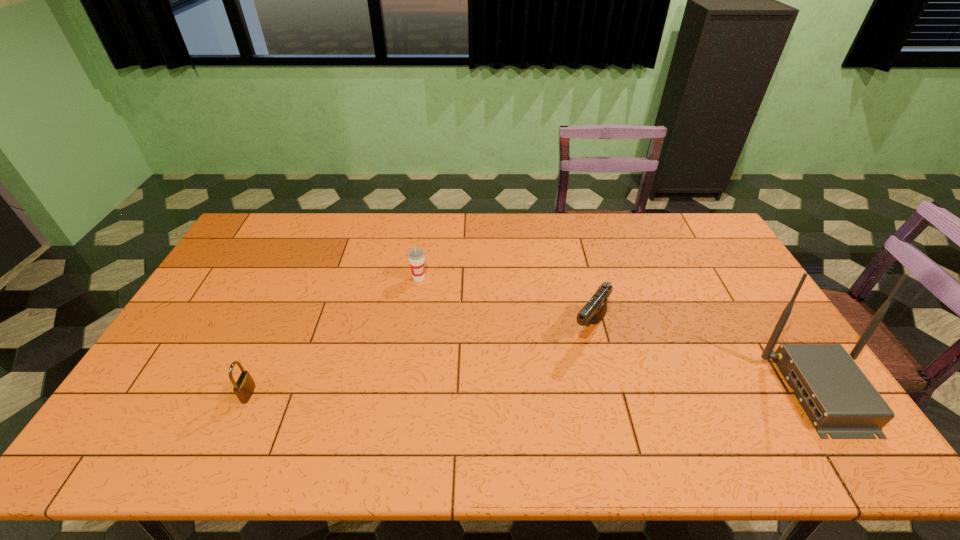
Image resolution: width=960 pixels, height=540 pixels. I want to click on free space on the desktop that is between the padlock and the router and is positioned at the barrel of the pistol, so click(540, 393).

The height and width of the screenshot is (540, 960). In order to click on free space on the desktop that is between the leftmost object and the tallest object and is positioned on the side of the third object from right to left with the logo in this screenshot , I will do `click(499, 393)`.